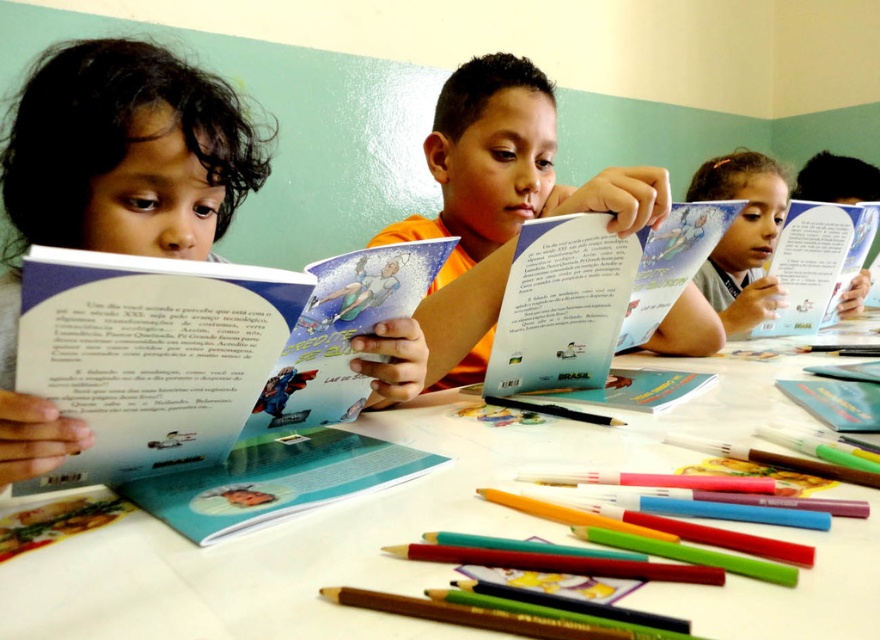
You are a teacher organizing a classroom activity. You need to place both the matte blue book at upper right and the hardcover book at upper right on a shelf that can only hold items up to 10 cm in height. Which book should you avoid placing on the shelf?

The matte blue book at upper right has a greater height compared to the hardcover book at upper right. Therefore, you should avoid placing the matte blue book at upper right on the shelf since it exceeds the 10 cm height limit.

You are a child sitting at the table in the classroom. You want to reach the pencil closest to you. Which point, point (854, 200) or point (776, 314), is closer to your current position?

Point (776, 314) is closer to your current position because it is in front of point (854, 200).